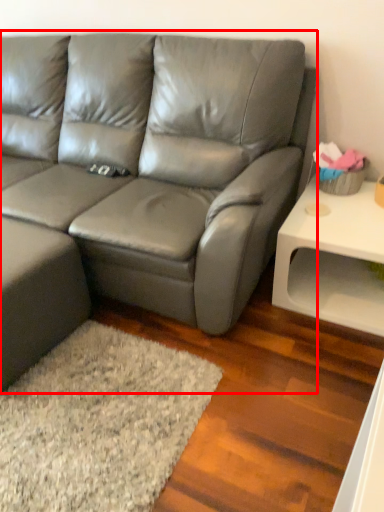
Question: From the image's perspective, where is studio couch (annotated by the red box) located in relation to table in the image?

Choices:
 (A) below
 (B) above

Answer: (B)